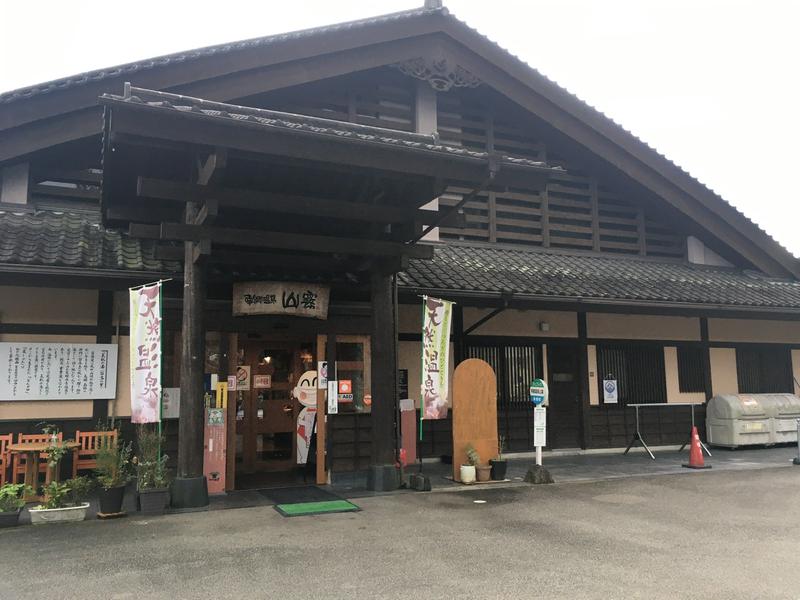
At what (x,y) coordinates should I click in order to perform the action: click on table. Please return your answer as a coordinate pair (x, y). Looking at the image, I should click on (641, 397).